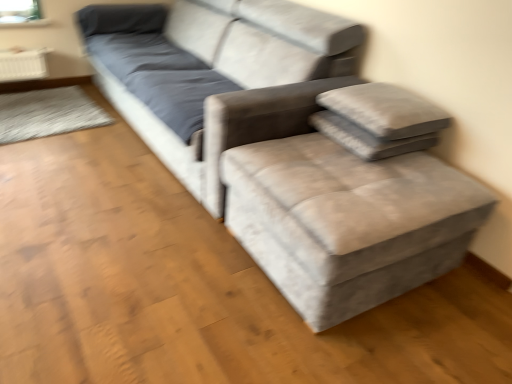
Describe the element at coordinates (367, 138) in the screenshot. The height and width of the screenshot is (384, 512). I see `gray fabric pillow at upper right, which appears as the first pillow when ordered from the bottom` at that location.

This screenshot has height=384, width=512. I want to click on textured gray couch at center, so click(288, 146).

Where is `textured gray pillow at upper right, the second pillow positioned from the bottom`? This screenshot has height=384, width=512. textured gray pillow at upper right, the second pillow positioned from the bottom is located at coordinates (385, 110).

Is velvet grey couch at center touching gray fabric pillow at upper right, which appears as the first pillow when ordered from the bottom?

velvet grey couch at center is not next to gray fabric pillow at upper right, which appears as the first pillow when ordered from the bottom, and they're not touching.

Is velvet grey couch at center to the left or to the right of gray fabric pillow at upper right, which appears as the first pillow when ordered from the bottom, in the image?

velvet grey couch at center is positioned on gray fabric pillow at upper right, which appears as the first pillow when ordered from the bottom,'s left side.

Is velvet grey couch at center facing away from gray fabric pillow at upper right, which is counted as the 2th pillow, starting from the top?

No, velvet grey couch at center's orientation is not away from gray fabric pillow at upper right, which is counted as the 2th pillow, starting from the top.

Is velvet grey couch at center behind gray fabric pillow at upper right, which is counted as the 2th pillow, starting from the top?

No, velvet grey couch at center is closer to the camera.

Does textured gray pillow at upper right, the second pillow positioned from the bottom, appear on the left side of textured gray couch at center?

No.

Considering the sizes of textured gray pillow at upper right, which ranks as the first pillow in top-to-bottom order, and textured gray couch at center in the image, is textured gray pillow at upper right, which ranks as the first pillow in top-to-bottom order, wider or thinner than textured gray couch at center?

Considering their sizes, textured gray pillow at upper right, which ranks as the first pillow in top-to-bottom order, looks slimmer than textured gray couch at center.

Is textured gray pillow at upper right, the second pillow positioned from the bottom, taller or shorter than textured gray couch at center?

textured gray pillow at upper right, the second pillow positioned from the bottom, is taller than textured gray couch at center.

Is textured gray pillow at upper right, which ranks as the first pillow in top-to-bottom order, not near textured gray couch at center?

They are positioned close to each other.

From the image's perspective, is velvet grey couch at center on top of textured gray pillow at upper right, which ranks as the first pillow in top-to-bottom order?

Yes.

Is velvet grey couch at center wider or thinner than textured gray pillow at upper right, which ranks as the first pillow in top-to-bottom order?

In the image, velvet grey couch at center appears to be wider than textured gray pillow at upper right, which ranks as the first pillow in top-to-bottom order.

Are velvet grey couch at center and textured gray pillow at upper right, the second pillow positioned from the bottom, located far from each other?

That's not correct — velvet grey couch at center is a little close to textured gray pillow at upper right, the second pillow positioned from the bottom.

Considering the relative positions of velvet grey couch at center and textured gray pillow at upper right, the second pillow positioned from the bottom, in the image provided, is velvet grey couch at center behind textured gray pillow at upper right, the second pillow positioned from the bottom,?

That is False.

Considering the positions of point (451, 267) and point (354, 153), is point (451, 267) closer or farther from the camera than point (354, 153)?

Point (451, 267) appears to be farther away from the viewer than point (354, 153).

Consider the image. Can we say textured gray couch at center lies outside gray fabric pillow at upper right, which is counted as the 2th pillow, starting from the top?

Yes.

From a real-world perspective, is textured gray couch at center over gray fabric pillow at upper right, which appears as the first pillow when ordered from the bottom?

No, from a real-world perspective, textured gray couch at center is not on top of gray fabric pillow at upper right, which appears as the first pillow when ordered from the bottom.

How far apart are velvet grey couch at center and textured gray couch at center?

They are 6.21 inches apart.

Which point is more distant from viewer, (146, 28) or (116, 67)?

The point (146, 28) is behind.

In terms of width, does velvet grey couch at center look wider or thinner when compared to textured gray couch at center?

Clearly, velvet grey couch at center has less width compared to textured gray couch at center.

In the scene shown: Is velvet grey couch at center spatially inside textured gray couch at center, or outside of it?

velvet grey couch at center cannot be found inside textured gray couch at center.

Consider the image. From a real-world perspective, does textured gray couch at center stand above velvet grey couch at center?

No.

Choose the correct answer: Is textured gray couch at center inside velvet grey couch at center or outside it?

textured gray couch at center lies outside velvet grey couch at center.

How many degrees apart are the facing directions of textured gray couch at center and velvet grey couch at center?

textured gray couch at center and velvet grey couch at center are facing 89.3 degrees away from each other.

Which is closer, (x=413, y=112) or (x=376, y=150)?

Point (x=413, y=112) is farther from the camera than point (x=376, y=150).

Considering their positions, is textured gray pillow at upper right, which ranks as the first pillow in top-to-bottom order, located in front of or behind gray fabric pillow at upper right, which appears as the first pillow when ordered from the bottom?

Clearly, textured gray pillow at upper right, which ranks as the first pillow in top-to-bottom order, is in front of gray fabric pillow at upper right, which appears as the first pillow when ordered from the bottom.

Is textured gray pillow at upper right, which ranks as the first pillow in top-to-bottom order, with gray fabric pillow at upper right, which is counted as the 2th pillow, starting from the top?

Yes, textured gray pillow at upper right, which ranks as the first pillow in top-to-bottom order, is beside gray fabric pillow at upper right, which is counted as the 2th pillow, starting from the top.

The width and height of the screenshot is (512, 384). I want to click on the 2nd pillow below the velvet grey couch at center (from the image's perspective), so click(x=367, y=138).

This screenshot has width=512, height=384. I want to click on the 2nd pillow to the right of the textured gray couch at center, counting from the anchor's position, so click(x=385, y=110).

Which object lies nearer to the anchor point textured gray pillow at upper right, which ranks as the first pillow in top-to-bottom order, gray fabric pillow at upper right, which appears as the first pillow when ordered from the bottom, or textured gray couch at center?

Based on the image, gray fabric pillow at upper right, which appears as the first pillow when ordered from the bottom, appears to be nearer to textured gray pillow at upper right, which ranks as the first pillow in top-to-bottom order.

When comparing their distances from gray fabric pillow at upper right, which appears as the first pillow when ordered from the bottom, does textured gray couch at center or textured gray pillow at upper right, which ranks as the first pillow in top-to-bottom order, seem closer?

The object closer to gray fabric pillow at upper right, which appears as the first pillow when ordered from the bottom, is textured gray pillow at upper right, which ranks as the first pillow in top-to-bottom order.

Looking at the image, which one is located closer to textured gray pillow at upper right, which ranks as the first pillow in top-to-bottom order, textured gray couch at center or velvet grey couch at center?

Based on the image, textured gray couch at center appears to be nearer to textured gray pillow at upper right, which ranks as the first pillow in top-to-bottom order.

Based on the photo, which object lies further to the anchor point textured gray couch at center, textured gray pillow at upper right, the second pillow positioned from the bottom, or velvet grey couch at center?

textured gray pillow at upper right, the second pillow positioned from the bottom, is positioned further to the anchor textured gray couch at center.

Considering their positions, is velvet grey couch at center positioned further to textured gray couch at center than textured gray pillow at upper right, the second pillow positioned from the bottom?

textured gray pillow at upper right, the second pillow positioned from the bottom, is positioned further to the anchor textured gray couch at center.

Considering their positions, is velvet grey couch at center positioned further to gray fabric pillow at upper right, which is counted as the 2th pillow, starting from the top, than textured gray couch at center?

Based on the image, velvet grey couch at center appears to be further to gray fabric pillow at upper right, which is counted as the 2th pillow, starting from the top.

From the image, which object appears to be nearer to textured gray couch at center, gray fabric pillow at upper right, which appears as the first pillow when ordered from the bottom, or velvet grey couch at center?

velvet grey couch at center.

Looking at the image, which one is located further to textured gray couch at center, velvet grey couch at center or gray fabric pillow at upper right, which is counted as the 2th pillow, starting from the top?

Based on the image, gray fabric pillow at upper right, which is counted as the 2th pillow, starting from the top, appears to be further to textured gray couch at center.

You are a GUI agent. You are given a task and a screenshot of the screen. Output one action in this format:
    pyautogui.click(x=<x>, y=<y>)
    Task: Click on the couch between textured gray couch at center and gray fabric pillow at upper right, which is counted as the 2th pillow, starting from the top, in the horizontal direction
    Image resolution: width=512 pixels, height=384 pixels.
    Given the screenshot: What is the action you would take?
    pyautogui.click(x=216, y=74)

You are a GUI agent. You are given a task and a screenshot of the screen. Output one action in this format:
    pyautogui.click(x=<x>, y=<y>)
    Task: Click on the couch situated between textured gray couch at center and textured gray pillow at upper right, which ranks as the first pillow in top-to-bottom order, from left to right
    This screenshot has width=512, height=384.
    Given the screenshot: What is the action you would take?
    pyautogui.click(x=216, y=74)

The width and height of the screenshot is (512, 384). I want to click on pillow between velvet grey couch at center and textured gray pillow at upper right, which ranks as the first pillow in top-to-bottom order, in the horizontal direction, so click(367, 138).

Identify the location of pillow between textured gray couch at center and textured gray pillow at upper right, the second pillow positioned from the bottom, from left to right. (367, 138).